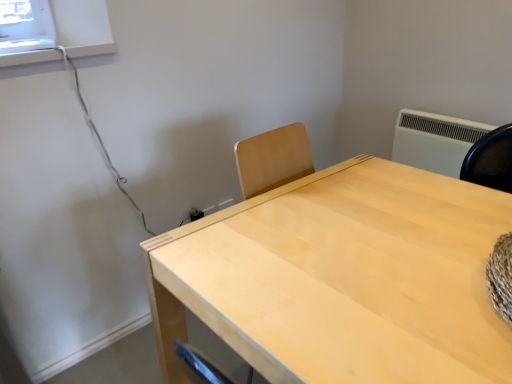
At what (x,y) coordinates should I click in order to perform the action: click on vacant area on top of light wood table at center (from a real-world perspective). Please return your answer as a coordinate pair (x, y). Looking at the image, I should click on (353, 234).